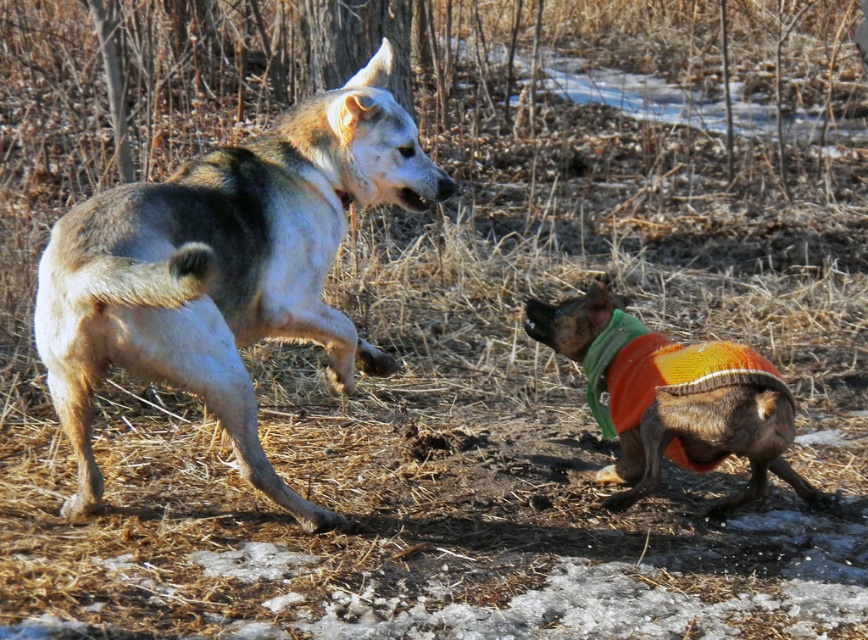
Is gray-furred dog at left bigger than multicolored knitted sweater at lower right?

Correct, gray-furred dog at left is larger in size than multicolored knitted sweater at lower right.

Who is more forward, (281,122) or (761,468)?

Positioned in front is point (761,468).

Identify the location of gray-furred dog at left. (227, 268).